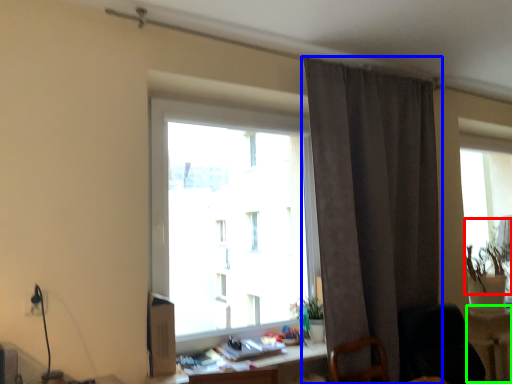
Question: Estimate the real-world distances between objects in this image. Which object is farther from plant (highlighted by a red box), curtain (highlighted by a blue box) or table (highlighted by a green box)?

Choices:
 (A) curtain
 (B) table

Answer: (A)